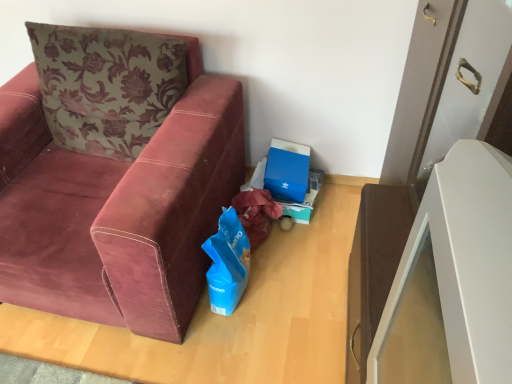
Question: Can you confirm if blue cardboard box at center is thinner than velvet maroon couch at left?

Choices:
 (A) yes
 (B) no

Answer: (A)

Question: From the image's perspective, is blue cardboard box at center located beneath velvet maroon couch at left?

Choices:
 (A) no
 (B) yes

Answer: (B)

Question: From the image's perspective, is blue cardboard box at center above velvet maroon couch at left?

Choices:
 (A) yes
 (B) no

Answer: (B)

Question: Would you consider blue cardboard box at center to be distant from velvet maroon couch at left?

Choices:
 (A) yes
 (B) no

Answer: (B)

Question: Is blue cardboard box at center with velvet maroon couch at left?

Choices:
 (A) yes
 (B) no

Answer: (B)

Question: Is blue cardboard box at center wider or thinner than blue matte gift bag at lower center?

Choices:
 (A) wide
 (B) thin

Answer: (B)

Question: Looking at the image, does blue cardboard box at center seem bigger or smaller compared to blue matte gift bag at lower center?

Choices:
 (A) small
 (B) big

Answer: (A)

Question: From a real-world perspective, relative to blue matte gift bag at lower center, is blue cardboard box at center vertically above or below?

Choices:
 (A) above
 (B) below

Answer: (B)

Question: Which is correct: blue cardboard box at center is inside blue matte gift bag at lower center, or outside of it?

Choices:
 (A) outside
 (B) inside

Answer: (A)

Question: Is blue matte gift bag at lower center bigger or smaller than velvet maroon couch at left?

Choices:
 (A) small
 (B) big

Answer: (A)

Question: Looking at their shapes, would you say blue matte gift bag at lower center is wider or thinner than velvet maroon couch at left?

Choices:
 (A) thin
 (B) wide

Answer: (A)

Question: Is blue matte gift bag at lower center inside or outside of velvet maroon couch at left?

Choices:
 (A) inside
 (B) outside

Answer: (B)

Question: In the image, is blue matte gift bag at lower center on the left side or the right side of velvet maroon couch at left?

Choices:
 (A) right
 (B) left

Answer: (A)

Question: Is blue cardboard box at center in front of or behind velvet maroon couch at left in the image?

Choices:
 (A) front
 (B) behind

Answer: (B)

Question: Is blue cardboard box at center spatially inside velvet maroon couch at left, or outside of it?

Choices:
 (A) inside
 (B) outside

Answer: (B)